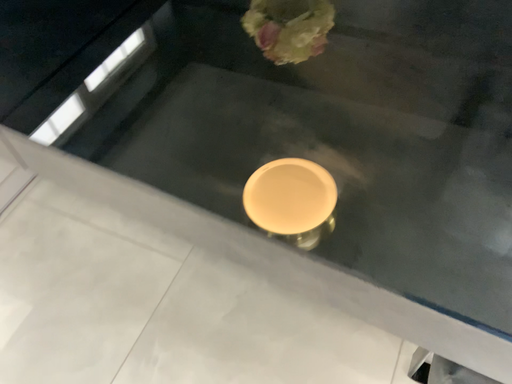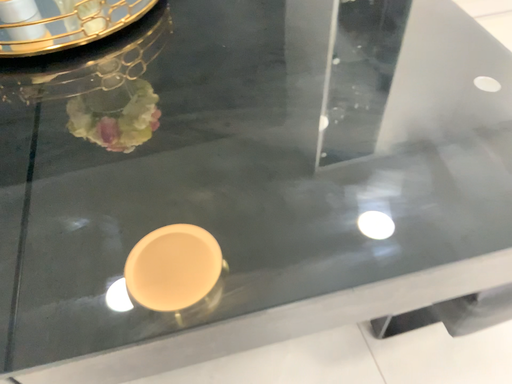
Question: How did the camera likely rotate when shooting the video?

Choices:
 (A) rotated downward
 (B) rotated upward

Answer: (B)